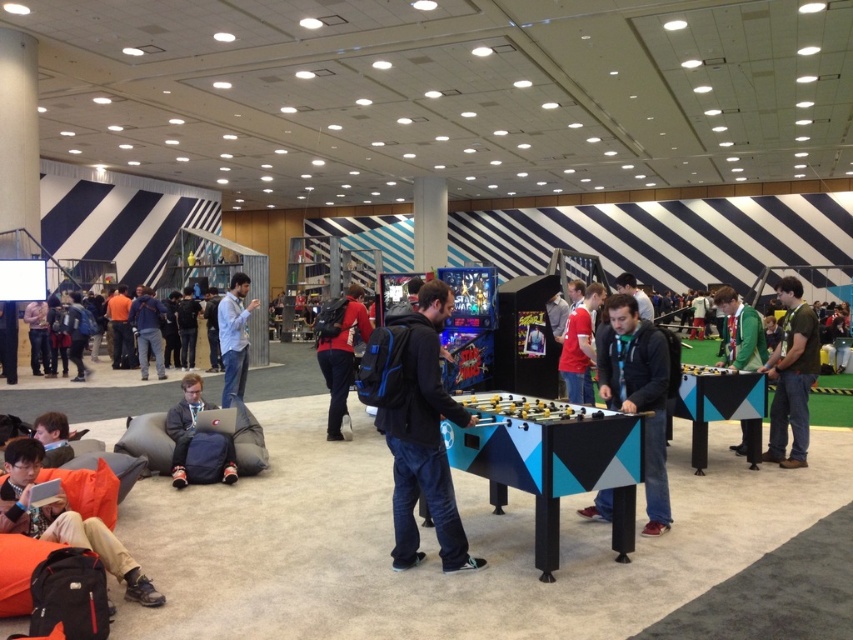
Question: Which point appears closest to the camera in this image?

Choices:
 (A) (134, 330)
 (B) (184, 426)
 (C) (786, 288)

Answer: (B)

Question: Which object is closer to the camera taking this photo?

Choices:
 (A) matte black jacket at lower left
 (B) matte black foosball table at center
 (C) green jersey at right
 (D) orange fabric bean bag at lower left

Answer: (D)

Question: Estimate the real-world distances between objects in this image. Which object is closer to the blue denim jeans at lower left?

Choices:
 (A) matte black backpack at center
 (B) matte black foosball table at center
 (C) matte black jacket at lower left
 (D) green jersey at right

Answer: (A)

Question: Can you confirm if dark blue backpack at center is wider than blue denim jeans at lower left?

Choices:
 (A) yes
 (B) no

Answer: (A)

Question: Is dark blue backpack at center smaller than green jersey at right?

Choices:
 (A) no
 (B) yes

Answer: (B)

Question: Can you confirm if green matte shirt at center is smaller than blue denim jeans at lower left?

Choices:
 (A) no
 (B) yes

Answer: (A)